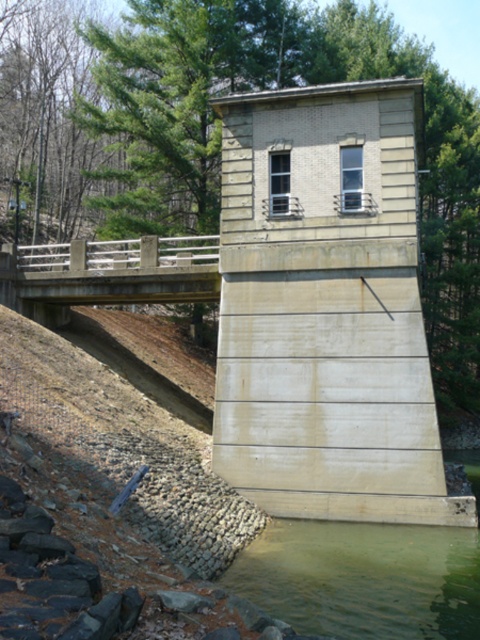
Is point (264, 536) positioned before point (172, 285)?

Yes, point (264, 536) is in front of point (172, 285).

Between point (256, 572) and point (108, 266), which one is positioned behind?

Point (108, 266)

What are the coordinates of `greenish concrete water at lower center` in the screenshot? It's located at (363, 579).